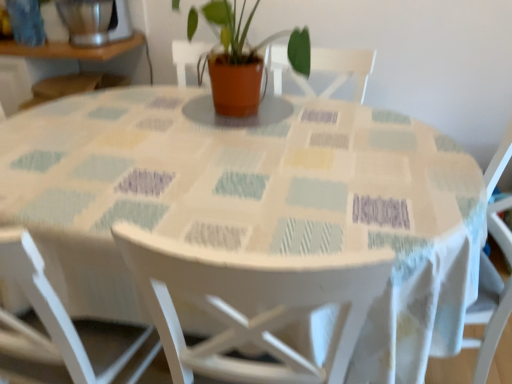
Question: Is white wood chair at lower left, the 2th chair from the right, surrounded by white wood chair at center, the 1th chair when ordered from right to left?

Choices:
 (A) yes
 (B) no

Answer: (B)

Question: Is white wood chair at center, which ranks as the second chair in left-to-right order, thinner than white wood chair at lower left, the 2th chair from the right?

Choices:
 (A) no
 (B) yes

Answer: (A)

Question: Is white wood chair at center, the 1th chair when ordered from right to left, facing towards white wood chair at lower left, the 2th chair from the right?

Choices:
 (A) no
 (B) yes

Answer: (A)

Question: Is white wood chair at center, the 1th chair when ordered from right to left, beside white wood chair at lower left, arranged as the 1th chair when viewed from the left?

Choices:
 (A) no
 (B) yes

Answer: (A)

Question: From the image's perspective, is white wood chair at center, the 1th chair when ordered from right to left, located above white wood chair at lower left, arranged as the 1th chair when viewed from the left?

Choices:
 (A) yes
 (B) no

Answer: (B)

Question: From the image's perspective, does white wood chair at center, which ranks as the second chair in left-to-right order, appear lower than white wood chair at lower left, arranged as the 1th chair when viewed from the left?

Choices:
 (A) yes
 (B) no

Answer: (A)

Question: Considering the relative sizes of white wood chair at lower left, the 2th chair from the right, and matte terracotta pot at center in the image provided, is white wood chair at lower left, the 2th chair from the right, wider than matte terracotta pot at center?

Choices:
 (A) no
 (B) yes

Answer: (A)

Question: Does white wood chair at lower left, the 2th chair from the right, come in front of matte terracotta pot at center?

Choices:
 (A) yes
 (B) no

Answer: (A)

Question: Considering the relative sizes of white wood chair at lower left, the 2th chair from the right, and matte terracotta pot at center in the image provided, is white wood chair at lower left, the 2th chair from the right, smaller than matte terracotta pot at center?

Choices:
 (A) no
 (B) yes

Answer: (A)

Question: Is white wood chair at lower left, arranged as the 1th chair when viewed from the left, aimed at matte terracotta pot at center?

Choices:
 (A) no
 (B) yes

Answer: (B)

Question: From a real-world perspective, is white wood chair at lower left, arranged as the 1th chair when viewed from the left, physically above matte terracotta pot at center?

Choices:
 (A) no
 (B) yes

Answer: (A)

Question: Would you consider white wood chair at lower left, arranged as the 1th chair when viewed from the left, to be distant from matte terracotta pot at center?

Choices:
 (A) yes
 (B) no

Answer: (B)

Question: Is brushed metal blender at upper left at the back of matte terracotta pot at center?

Choices:
 (A) no
 (B) yes

Answer: (A)